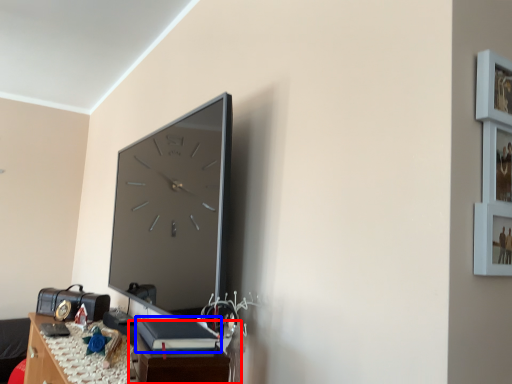
Question: Among these objects, which one is nearest to the camera, table (highlighted by a red box) or book (highlighted by a blue box)?

Choices:
 (A) table
 (B) book

Answer: (A)